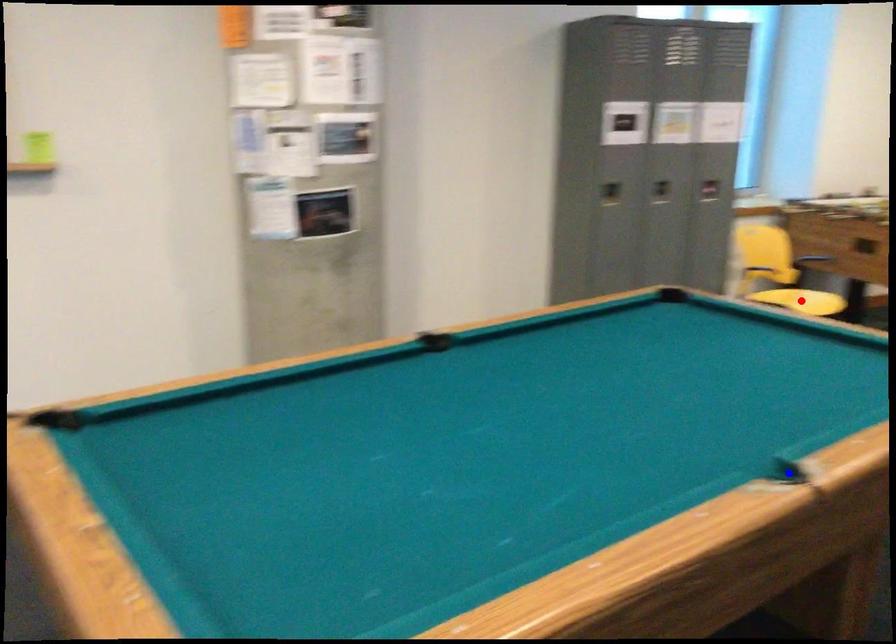
Question: Two points are marked on the image. Which point is closer to the camera?

Choices:
 (A) Blue point is closer.
 (B) Red point is closer.

Answer: (A)